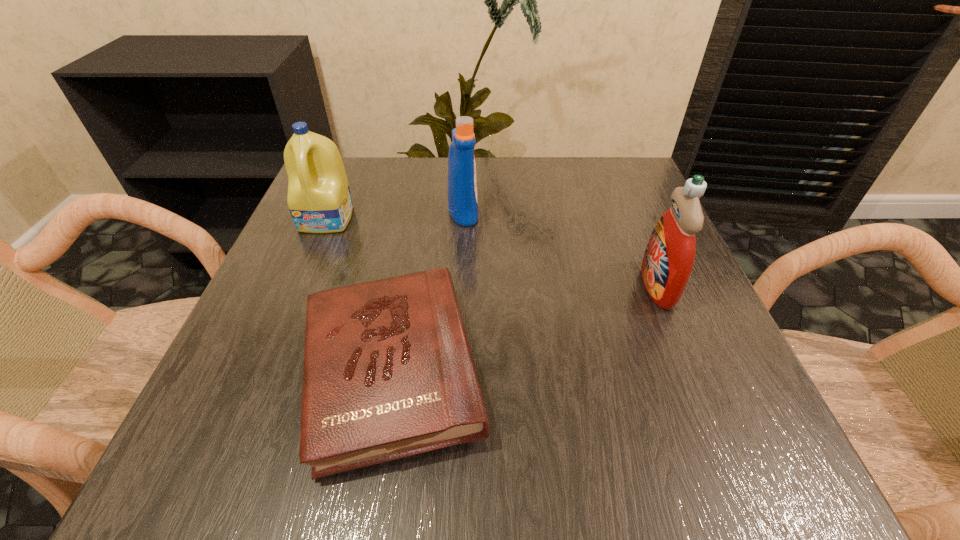
Find the location of a particular element. the nearest detergent is located at coordinates (668, 260).

Where is `the rightmost detergent`? This screenshot has height=540, width=960. the rightmost detergent is located at coordinates (668, 260).

Image resolution: width=960 pixels, height=540 pixels. I want to click on the second detergent from left to right, so click(462, 185).

This screenshot has width=960, height=540. Find the location of `the leftmost detergent`. the leftmost detergent is located at coordinates (319, 200).

Locate an element on the screen. the shortest object is located at coordinates (388, 373).

In order to click on vacant space located 0.090m on the front surface of the rightmost object in this screenshot , I will do `click(591, 286)`.

The width and height of the screenshot is (960, 540). Find the location of `free space located on the front surface of the rightmost object`. free space located on the front surface of the rightmost object is located at coordinates [x=515, y=286].

The height and width of the screenshot is (540, 960). I want to click on vacant space located 0.290m on the front surface of the rightmost object, so click(481, 286).

Where is `vacant point located 0.230m on the label of the second detergent from left to right`? Image resolution: width=960 pixels, height=540 pixels. vacant point located 0.230m on the label of the second detergent from left to right is located at coordinates (x=584, y=211).

At what (x,y) coordinates should I click in order to perform the action: click on vacant area located 0.220m on the label of the leftmost detergent. Please return your answer as a coordinate pair (x, y). Looking at the image, I should click on (287, 316).